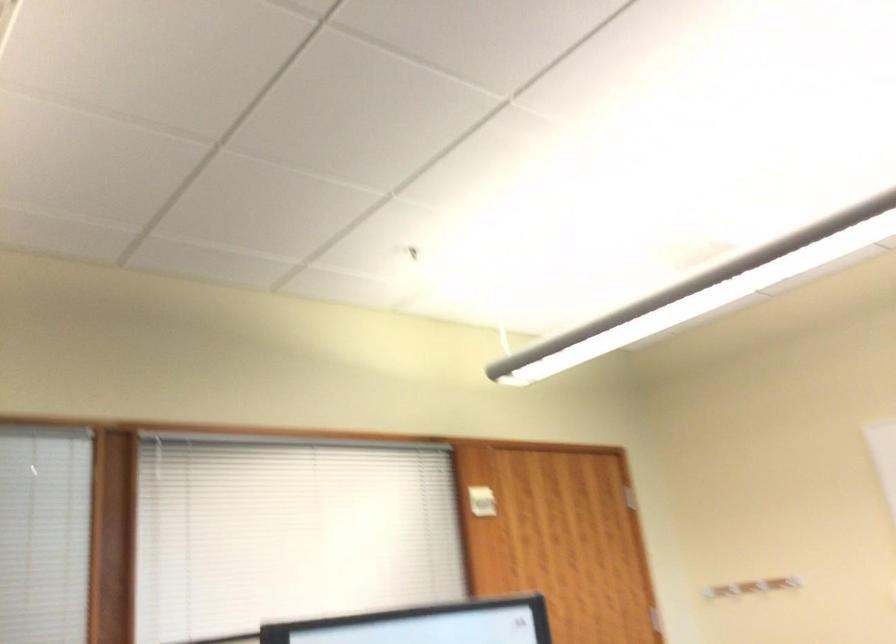
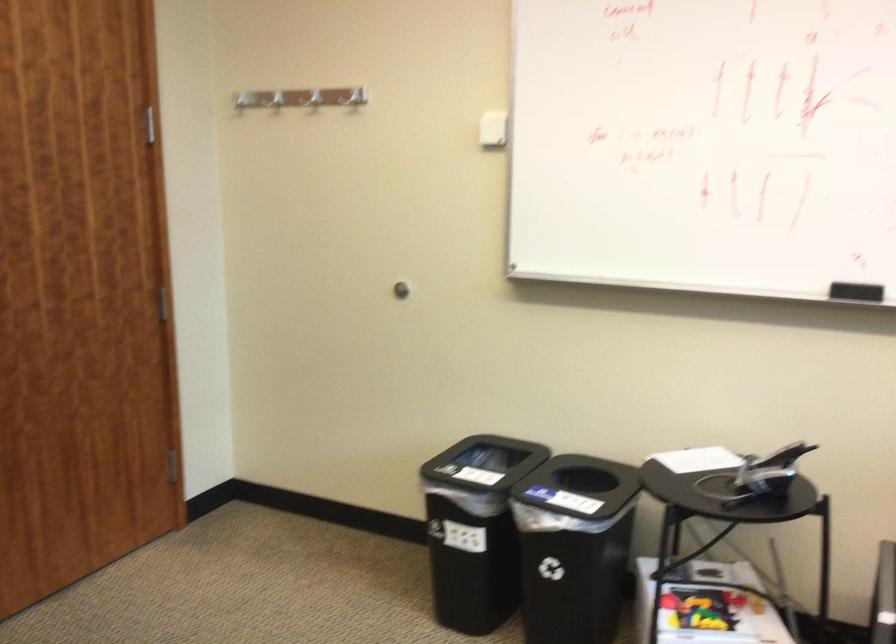
In the second image, find the point that corresponds to pixel 737 573 in the first image.

(352, 97)